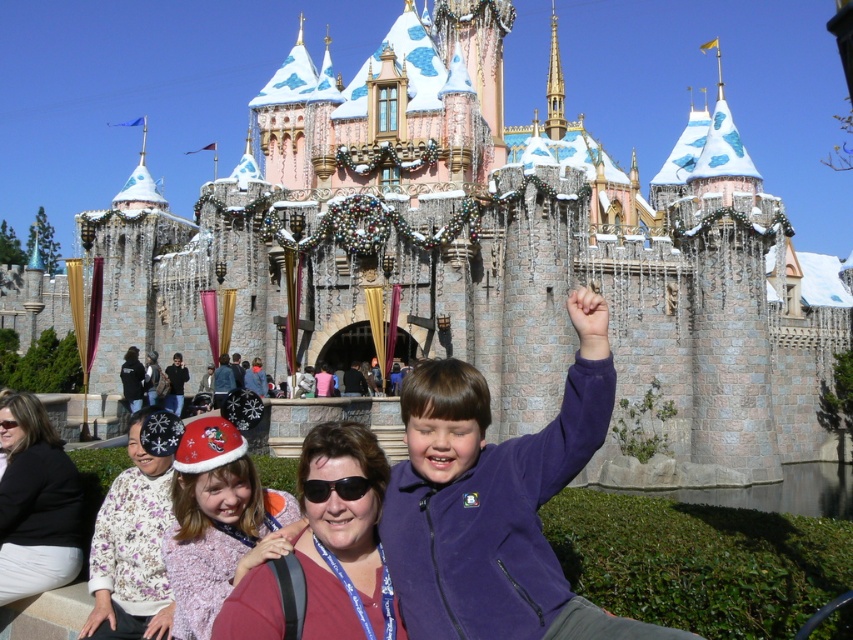
Question: Does purple fleece jacket at center have a larger size compared to fuzzy pink sweater at lower left?

Choices:
 (A) yes
 (B) no

Answer: (A)

Question: Which is farther from the matte red shirt at center?

Choices:
 (A) purple fleece jacket at center
 (B) fuzzy pink sweater at lower left
 (C) matte black jacket at lower left
 (D) floral fabric shirt at lower left

Answer: (C)

Question: Among these points, which one is nearest to the camera?

Choices:
 (A) (65, 467)
 (B) (354, 483)
 (C) (297, 506)
 (D) (456, 557)

Answer: (D)

Question: Which point appears farthest from the camera in this image?

Choices:
 (A) (35, 486)
 (B) (136, 544)
 (C) (596, 324)

Answer: (A)

Question: Can you confirm if purple fleece jacket at center is bigger than fuzzy pink sweater at lower left?

Choices:
 (A) no
 (B) yes

Answer: (B)

Question: Can you confirm if purple fleece jacket at center is bigger than floral fabric shirt at lower left?

Choices:
 (A) yes
 (B) no

Answer: (A)